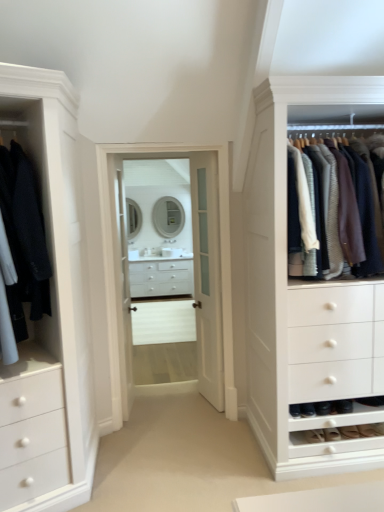
Where is `vacant space in white glass door at center (from a real-world perspective)`? This screenshot has width=384, height=512. vacant space in white glass door at center (from a real-world perspective) is located at coordinates (206, 404).